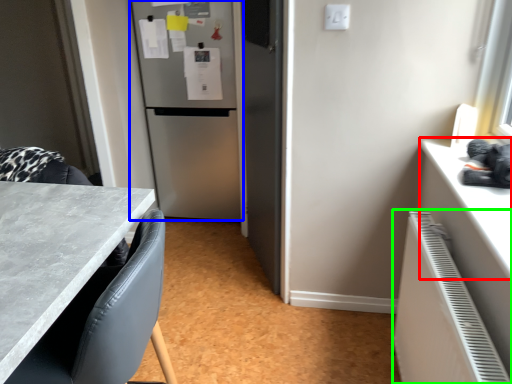
Question: Which is nearer to the counter top (highlighted by a red box)? refrigerator (highlighted by a blue box) or radiator (highlighted by a green box).

Choices:
 (A) refrigerator
 (B) radiator

Answer: (B)